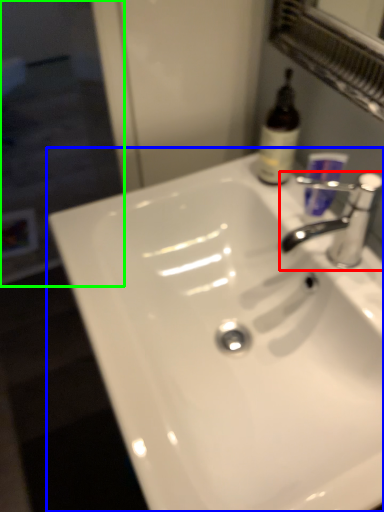
Question: Based on their relative distances, which object is farther from tap (highlighted by a red box)? Choose from sink (highlighted by a blue box) and screen door (highlighted by a green box).

Choices:
 (A) sink
 (B) screen door

Answer: (B)